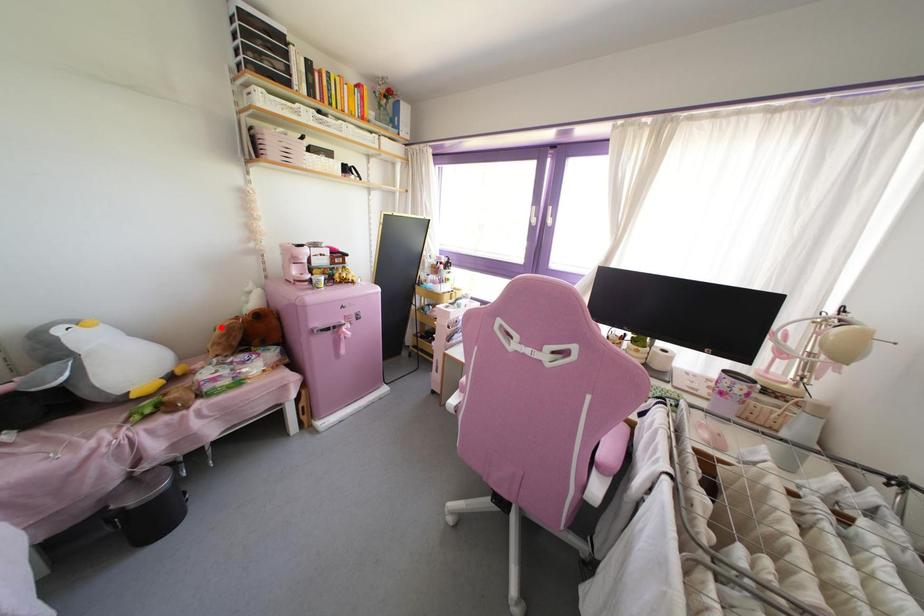
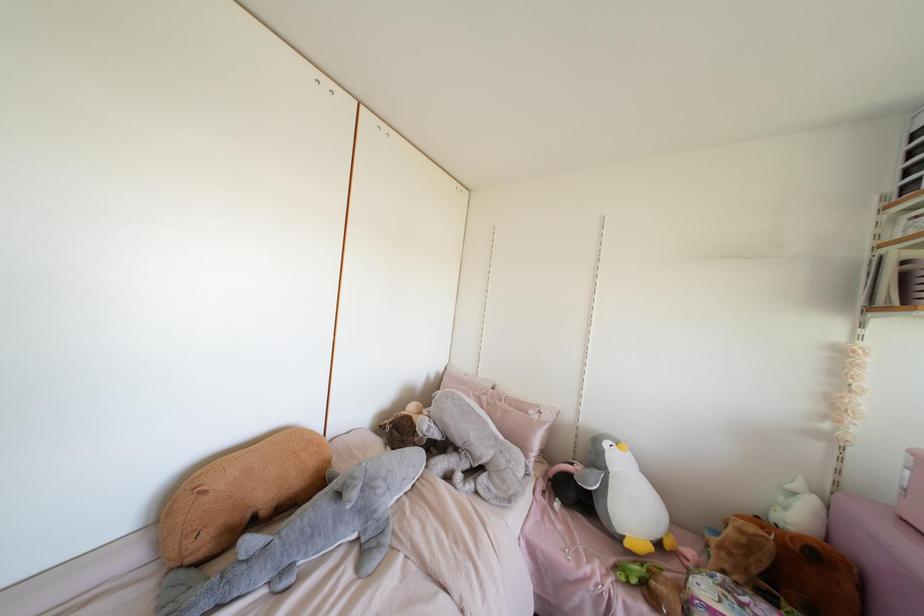
The point at the highlighted location is marked in the first image. Where is the corresponding point in the second image?

(739, 531)